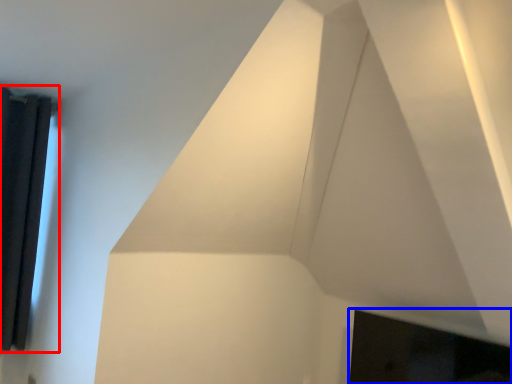
Question: Which point is closer to the camera, window (highlighted by a red box) or fireplace (highlighted by a blue box)?

Choices:
 (A) window
 (B) fireplace

Answer: (B)